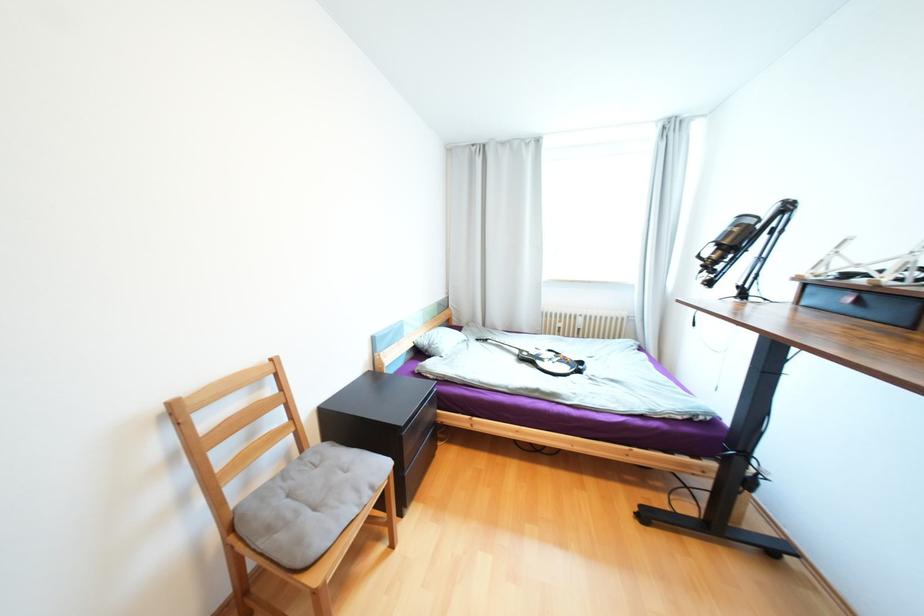
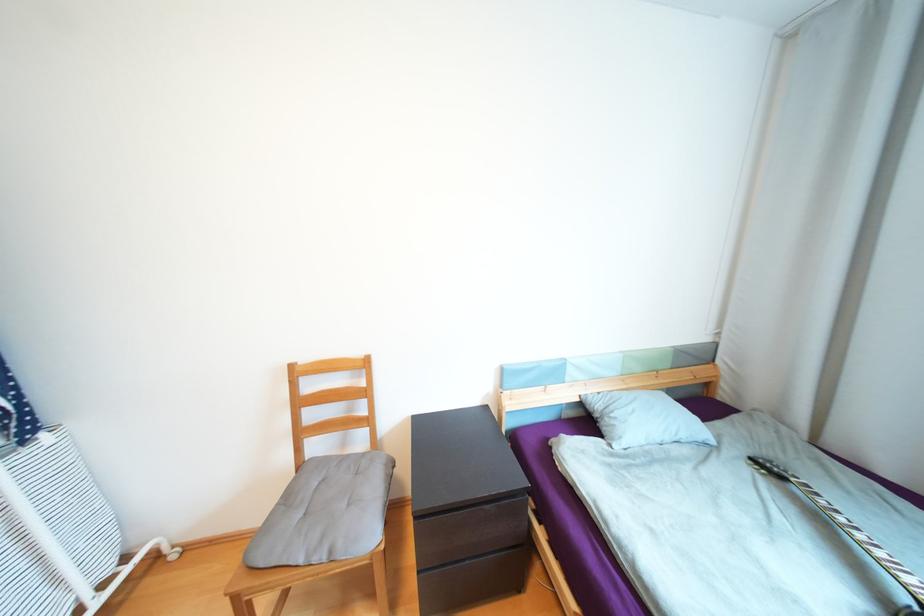
The point at (378, 488) is marked in the first image. Where is the corresponding point in the second image?

(335, 553)